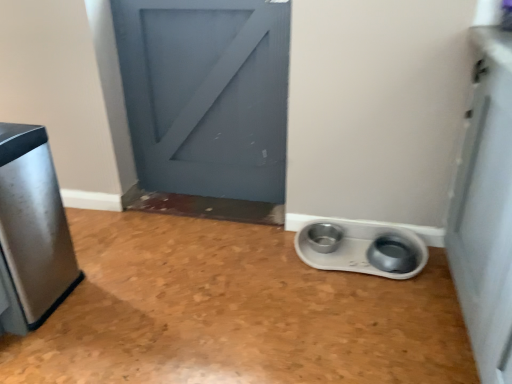
Where is `vacant area situated to the left side of white plastic pet bowls at lower right`? The height and width of the screenshot is (384, 512). vacant area situated to the left side of white plastic pet bowls at lower right is located at coordinates (266, 267).